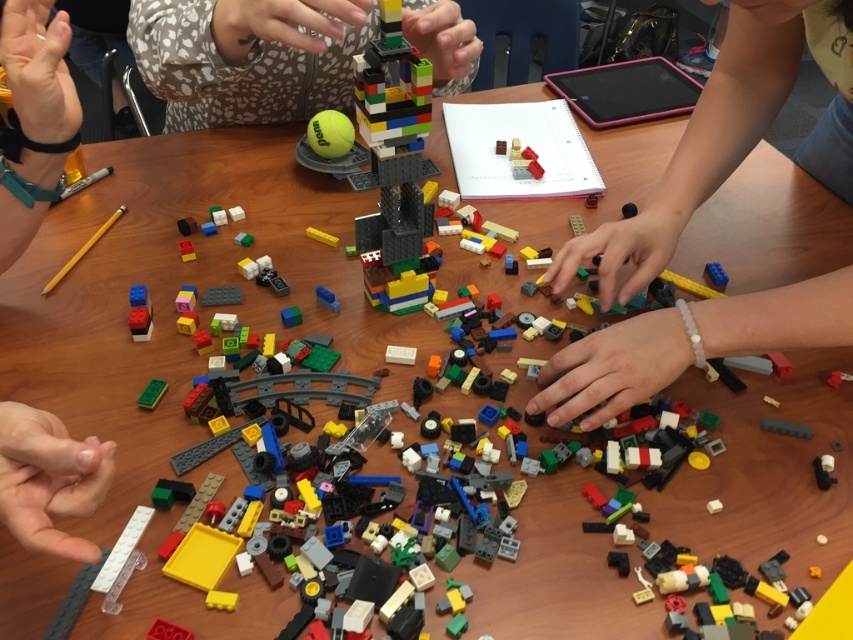
You are a jeweler who needs to place a protective cover over the white matte bracelet at lower center and the green matte brick at center. The covers have a maximum reach of 25 inches. Can you cover both items with a single cover?

The white matte bracelet at lower center is 27.09 inches away from the green matte brick at center. Since the maximum reach of the cover is 25 inches, the distance between them exceeds the cover capacity. Therefore, you cannot cover both items with a single cover.

You are a child trying to build a LEGO tower. You see the multicolored plastic lego tower at center and the smooth plastic hand at lower left. Which object is located to the right of the other?

The multicolored plastic lego tower at center is positioned to the right of the smooth plastic hand at lower left.

You are a LEGO enthusiast who wants to build a tower at the same location as the existing one. Is the multicolored plastic lego tower at center at point (248,58) available for you to use?

The multicolored plastic lego tower at center at point (248,58) is already present at that location, so it is not available for you to build another tower there.